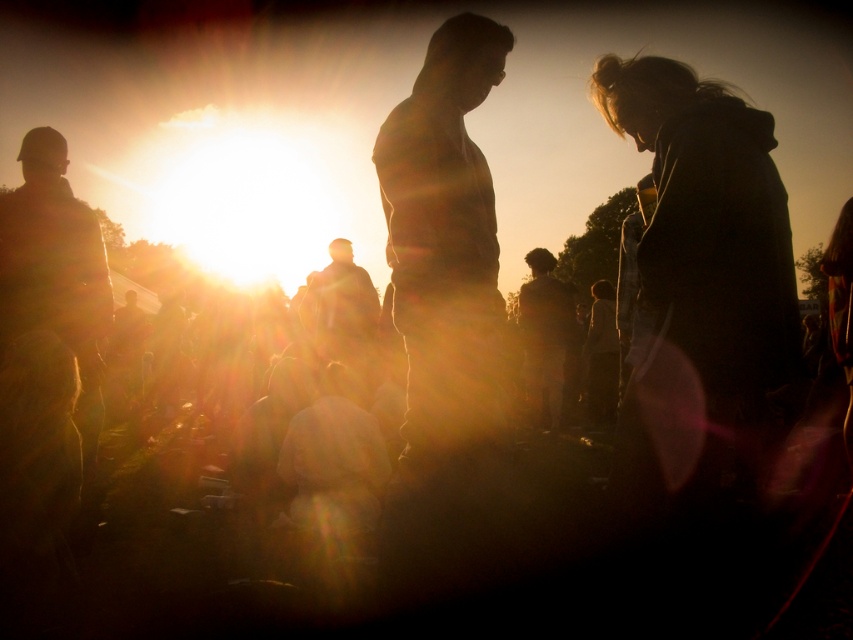
Is dark gray hoodie at right closer to camera compared to dark hair at center?

That is True.

Which is in front, point (660, 454) or point (558, 332)?

Point (660, 454) is more forward.

Who is more distant from viewer, (x=701, y=308) or (x=537, y=301)?

Positioned behind is point (x=537, y=301).

At what (x,y) coordinates should I click in order to perform the action: click on dark gray hoodie at right. Please return your answer as a coordinate pair (x, y). This screenshot has width=853, height=640. Looking at the image, I should click on (701, 276).

Who is higher up, dark gray hoodie at right or silhouette figure at center?

silhouette figure at center

Does point (633, 394) lie behind point (442, 362)?

Yes, point (633, 394) is farther from viewer.

At what (x,y) coordinates should I click in order to perform the action: click on dark gray hoodie at right. Please return your answer as a coordinate pair (x, y). The height and width of the screenshot is (640, 853). Looking at the image, I should click on (701, 276).

Is silhouette figure at center bigger than dark hair at center?

No.

Measure the distance from silhouette figure at center to dark hair at center.

silhouette figure at center and dark hair at center are 6.04 meters apart from each other.

Does point (479, 260) come behind point (547, 278)?

No, it is not.

Find the location of a particular element. This screenshot has height=640, width=853. silhouette figure at center is located at coordinates (444, 237).